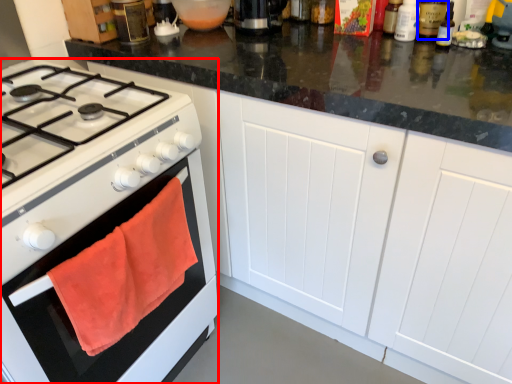
Question: Which point is further to the camera, gas stove (highlighted by a red box) or bottle (highlighted by a blue box)?

Choices:
 (A) gas stove
 (B) bottle

Answer: (B)